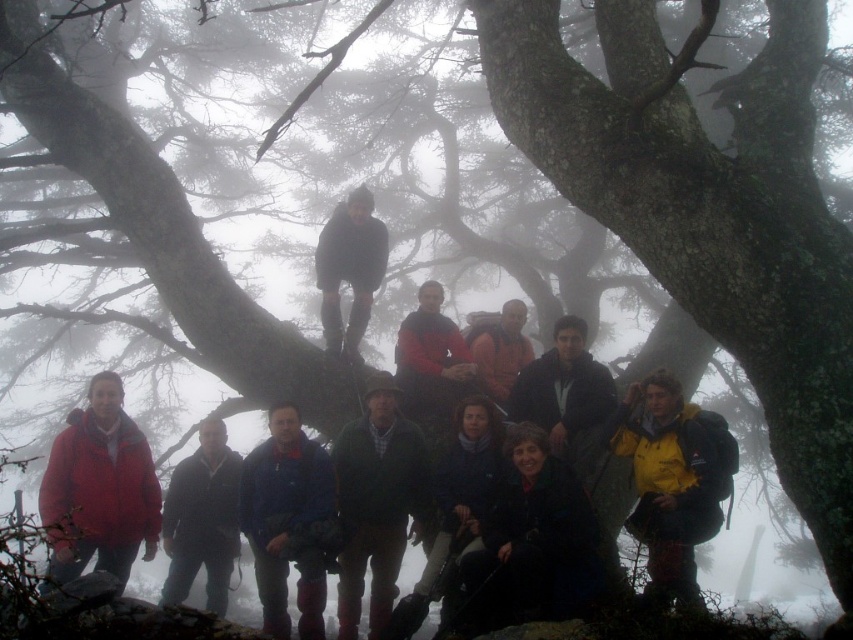
Does point (647, 406) lie in front of point (396, 500)?

That is True.

Who is taller, yellow matte jacket at lower right or green plaid shirt at center?

green plaid shirt at center is taller.

This screenshot has height=640, width=853. Describe the element at coordinates (672, 480) in the screenshot. I see `yellow matte jacket at lower right` at that location.

Where is `yellow matte jacket at lower right`? yellow matte jacket at lower right is located at coordinates (672, 480).

Can you confirm if blue fleece jacket at center is thinner than matte orange jacket at center?

No, blue fleece jacket at center is not thinner than matte orange jacket at center.

Is blue fleece jacket at center to the right of matte orange jacket at center from the viewer's perspective?

In fact, blue fleece jacket at center is to the left of matte orange jacket at center.

Based on the photo, measure the distance between point (289,547) and camera.

Point (289,547) is 7.22 meters from camera.

This screenshot has width=853, height=640. I want to click on blue fleece jacket at center, so click(288, 522).

Does green plaid shirt at center appear on the right side of blue fleece jacket at center?

Indeed, green plaid shirt at center is positioned on the right side of blue fleece jacket at center.

Is green plaid shirt at center closer to camera compared to blue fleece jacket at center?

No.

The width and height of the screenshot is (853, 640). Describe the element at coordinates (376, 502) in the screenshot. I see `green plaid shirt at center` at that location.

At what (x,y) coordinates should I click in order to perform the action: click on green plaid shirt at center. Please return your answer as a coordinate pair (x, y). Looking at the image, I should click on (376, 502).